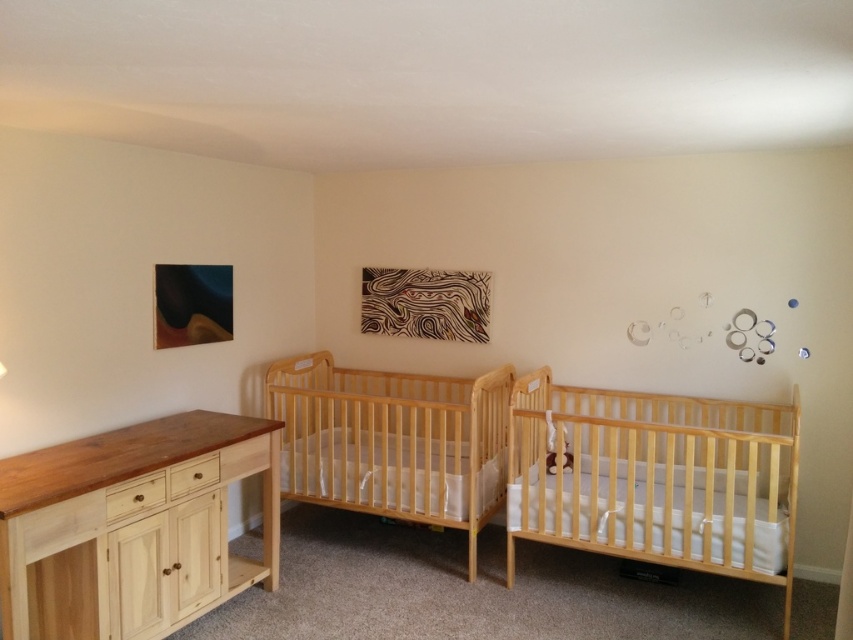
Does natural wood crib at center appear over pine wood drawer at lower left?

Correct, natural wood crib at center is located above pine wood drawer at lower left.

Measure the distance between point [463,506] and camera.

Point [463,506] is 11.41 feet away from camera.

Describe the element at coordinates (392, 442) in the screenshot. The image size is (853, 640). I see `natural wood crib at center` at that location.

Identify the location of natural wood crib at center. Image resolution: width=853 pixels, height=640 pixels. (392, 442).

Is light wood drawer at lower left to the left of white painted wood drawer at lower left from the viewer's perspective?

Incorrect, light wood drawer at lower left is not on the left side of white painted wood drawer at lower left.

Is point (257, 444) positioned before point (190, 465)?

That is False.

Is point (265, 438) farther from camera compared to point (202, 465)?

Yes, point (265, 438) is farther from viewer.

In order to click on light wood drawer at lower left in this screenshot , I will do 244,458.

Can you confirm if pine wood drawer at lower left is positioned to the right of white painted wood drawer at lower left?

Incorrect, pine wood drawer at lower left is not on the right side of white painted wood drawer at lower left.

Describe the element at coordinates (135, 497) in the screenshot. The image size is (853, 640). I see `pine wood drawer at lower left` at that location.

Describe the element at coordinates (135, 497) in the screenshot. I see `pine wood drawer at lower left` at that location.

Locate an element on the screen. Image resolution: width=853 pixels, height=640 pixels. pine wood drawer at lower left is located at coordinates (135, 497).